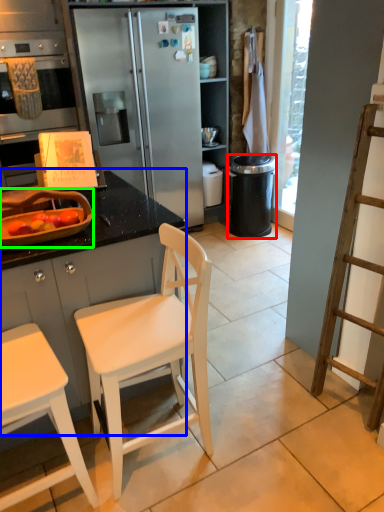
Question: Which object is the farthest from trash bin/can (highlighted by a red box)? Choose among these: cabinetry (highlighted by a blue box) or appliance (highlighted by a green box).

Choices:
 (A) cabinetry
 (B) appliance

Answer: (B)